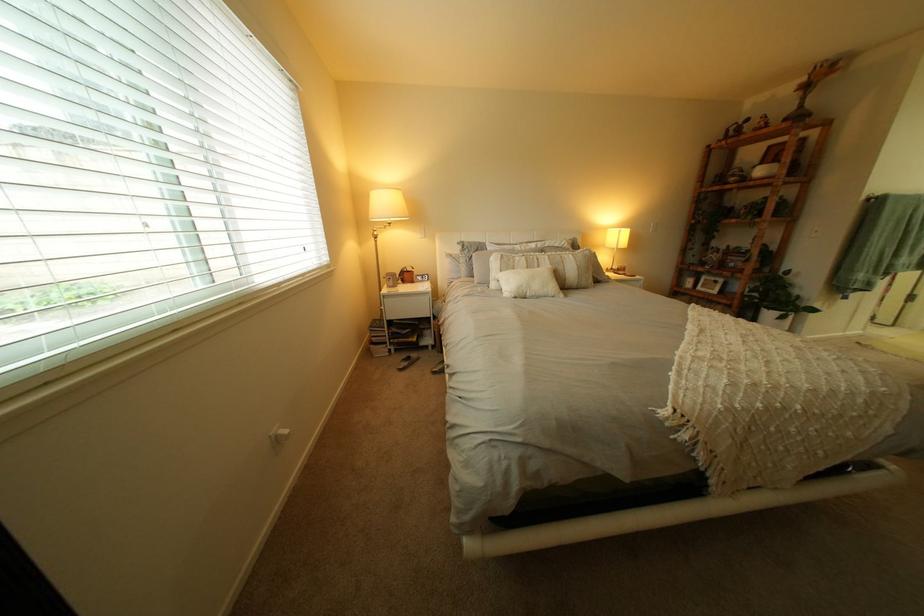
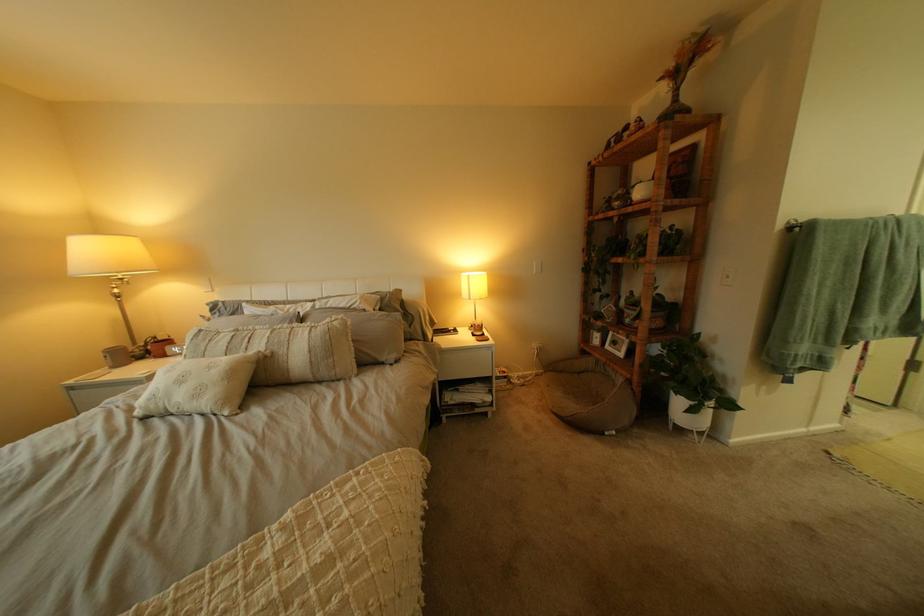
Find the pixel in the second image that matches (x=429, y=281) in the first image.

(180, 354)